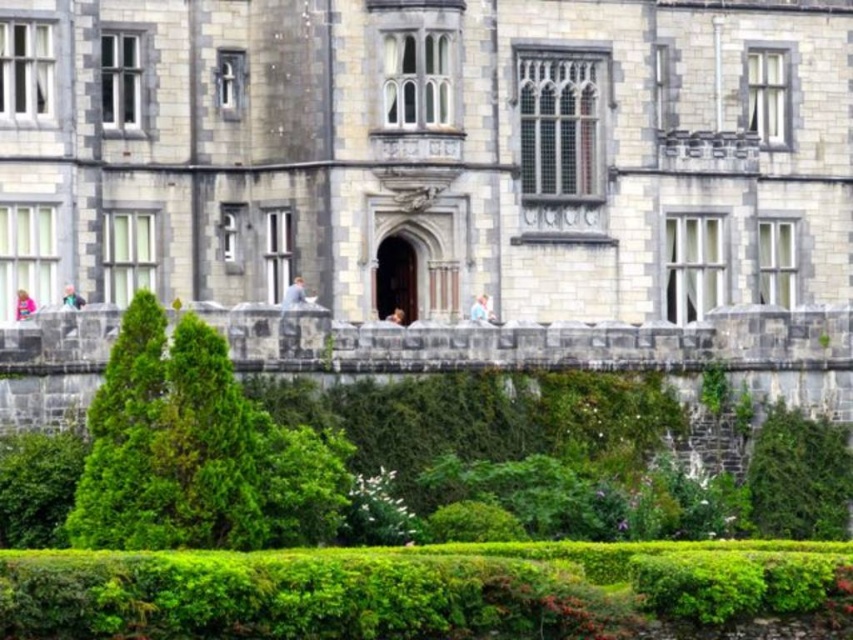
You are a landscape architect planning to install a pathway between the green leafy tree at lower left and the green leafy bush at lower right. The pathway must be exactly 20 meters long. Based on the scene, will the pathway fit between them?

The green leafy tree at lower left and green leafy bush at lower right are 20.96 meters apart. Since the pathway is 20 meters long, it will fit between them with 0.96 meters of space remaining.

You are standing in front of the grand stone building and want to take a photo. You notice two points marked on the building wall. The first point is at coordinates point (135, 424) and the second is at point (790, 438). Which point will appear larger in your photo?

Point (135, 424) will appear larger in the photo because it is closer to the camera than point (790, 438).